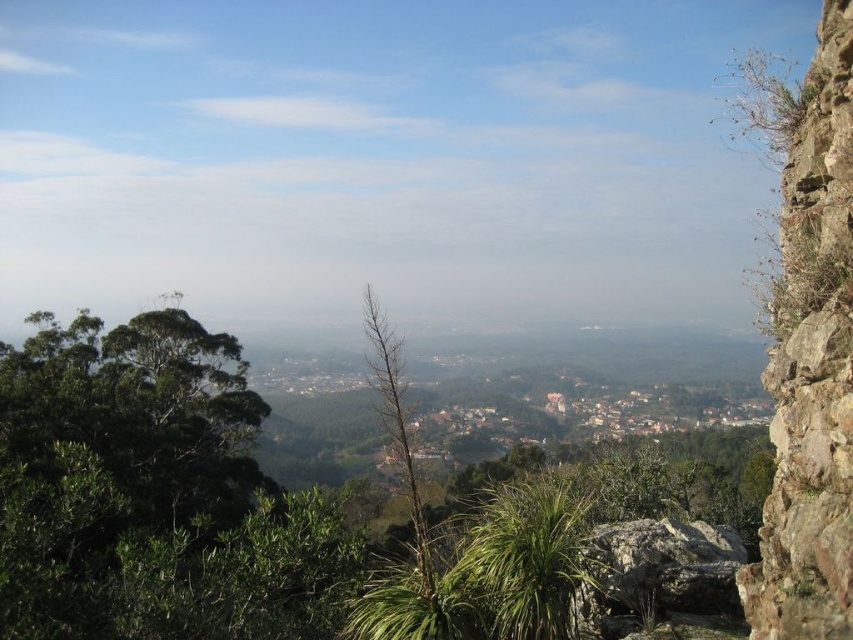
You are a hiker who wants to take a photo of the rough textured rock at center and the rusty stone cliff at right. Which object should you position to your left side to capture both in the frame?

The rusty stone cliff at right is to the right of the rough textured rock at center. To capture both in the frame, position the rough textured rock at center to your left side so that the rusty stone cliff at right will naturally be on the right side of the frame.

You are planning to place a small garden bench in the scene. The bench requires at least 1 meter of space to fit. Based on the image, can you determine if there is enough space between the rusty stone cliff at right and the rough textured rock at center for the bench?

The rusty stone cliff at right might be wider than the rough textured rock at center, so there is likely enough space for the bench.

You are standing at the viewpoint overlooking the valley and want to determine the relative positions of two points marked in the scene. Which of the two points, point (849, 93) or point (595, 540), is closer to you?

Point (849, 93) is closer to the viewer than point (595, 540).